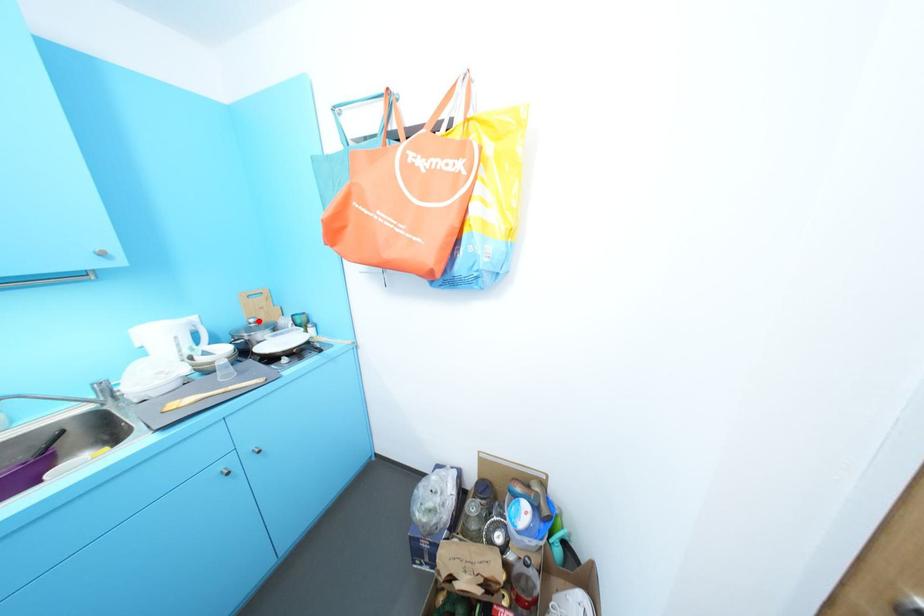
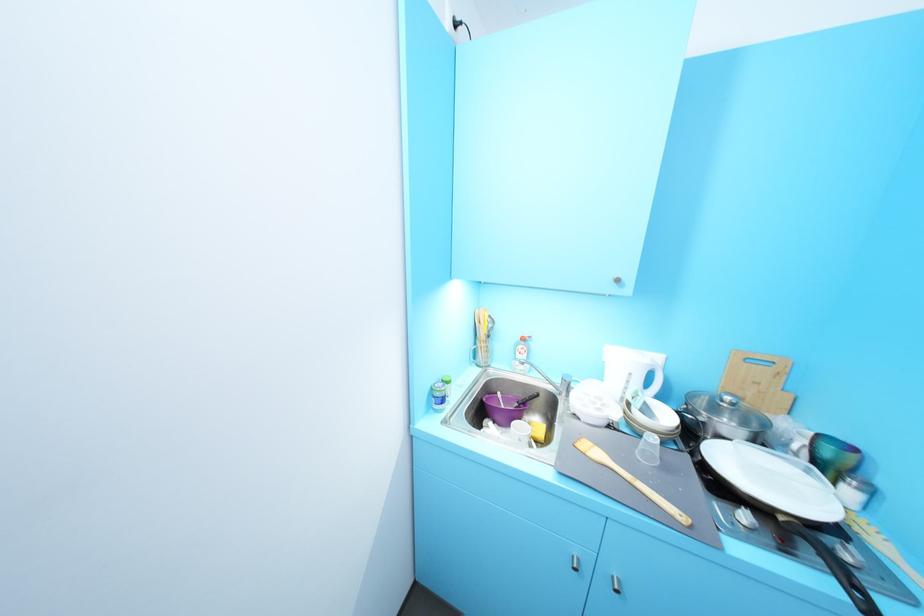
Locate, in the second image, the point that corresponds to the highlighted location in the first image.

(735, 399)